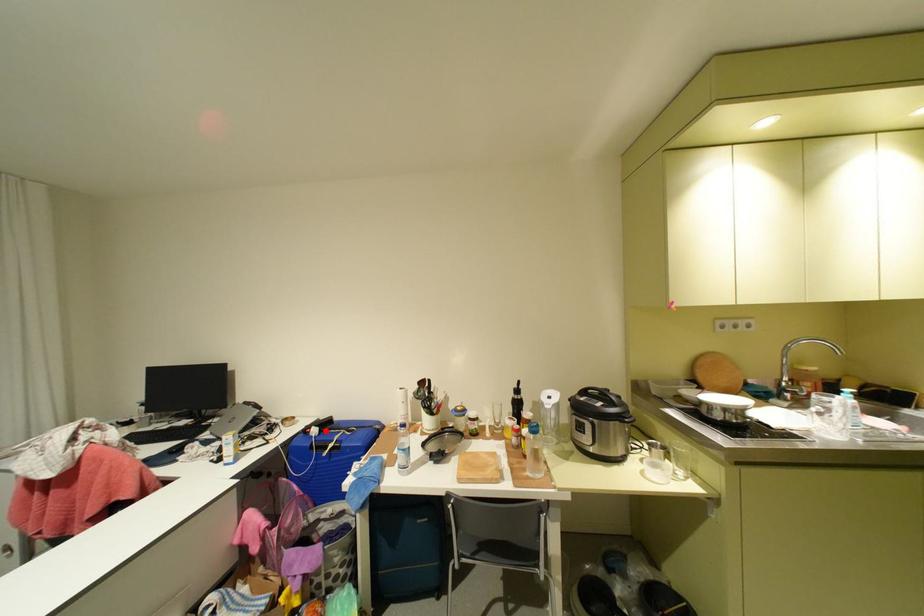
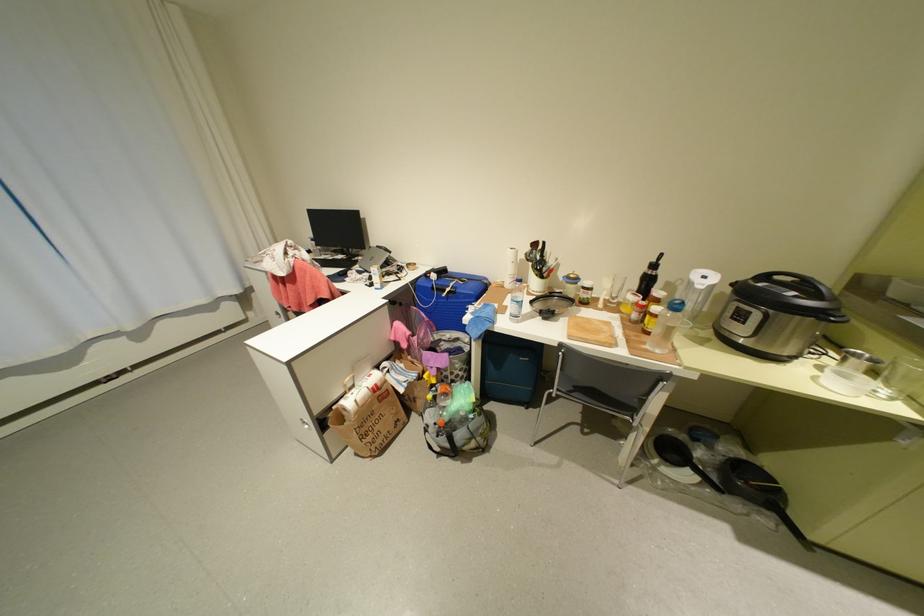
The point at the highlighted location is marked in the first image. Where is the corresponding point in the second image?

(444, 276)